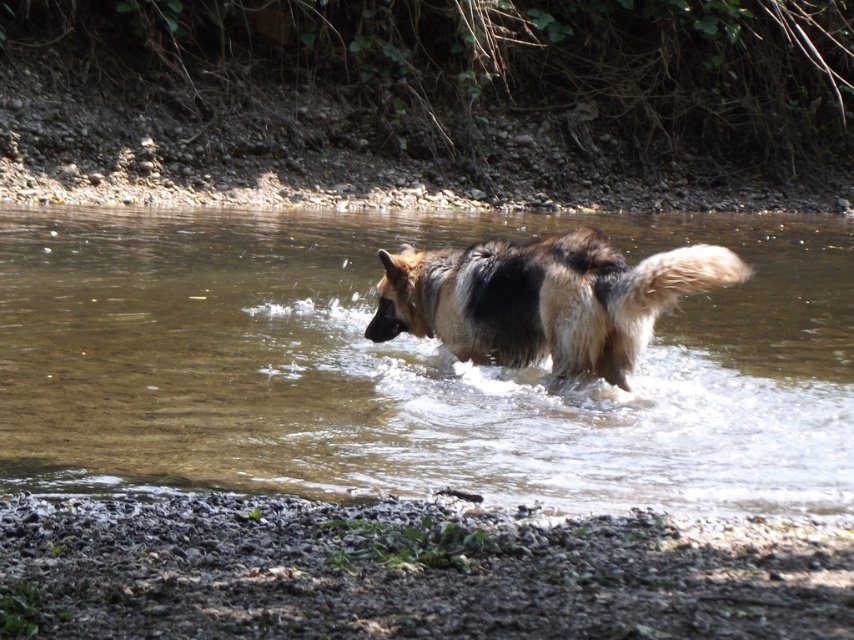
Looking at this image, which is below, clear water at center or brown fur dog at center?

brown fur dog at center is below.

Measure the distance between clear water at center and camera.

The distance of clear water at center from camera is 19.79 feet.

Which is behind, point (51, 420) or point (653, 282)?

The point (51, 420) is behind.

Identify the location of clear water at center. The height and width of the screenshot is (640, 854). (408, 365).